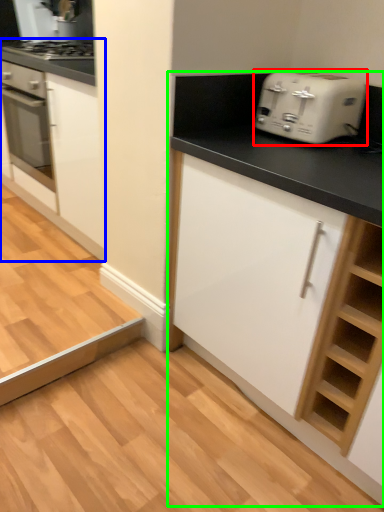
Question: Considering the real-world distances, which object is farthest from toaster (highlighted by a red box)? cabinetry (highlighted by a blue box) or cabinetry (highlighted by a green box)?

Choices:
 (A) cabinetry
 (B) cabinetry

Answer: (A)